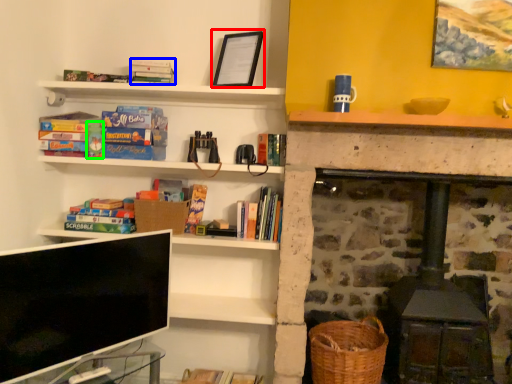
Question: Considering the real-world distances, which object is closest to picture frame (highlighted by a red box)? book (highlighted by a blue box) or paperback book (highlighted by a green box).

Choices:
 (A) book
 (B) paperback book

Answer: (A)